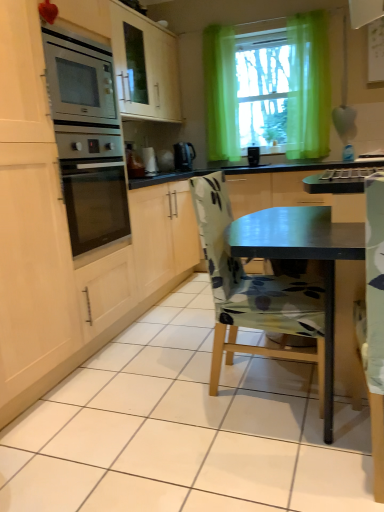
You are a GUI agent. You are given a task and a screenshot of the screen. Output one action in this format:
    pyautogui.click(x=<x>, y=<y>)
    Task: Click on the free space above green sheer curtain at upper center (from a real-world perspective)
    Image resolution: width=384 pixels, height=512 pixels.
    Given the screenshot: What is the action you would take?
    pyautogui.click(x=310, y=7)